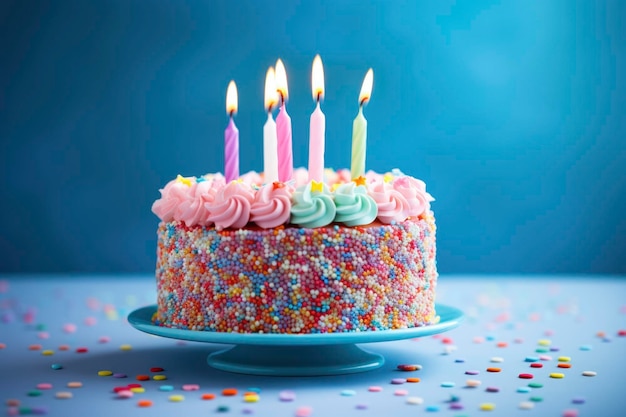
I want to click on candles, so click(x=227, y=155), click(x=268, y=159), click(x=320, y=140), click(x=357, y=141), click(x=294, y=136).